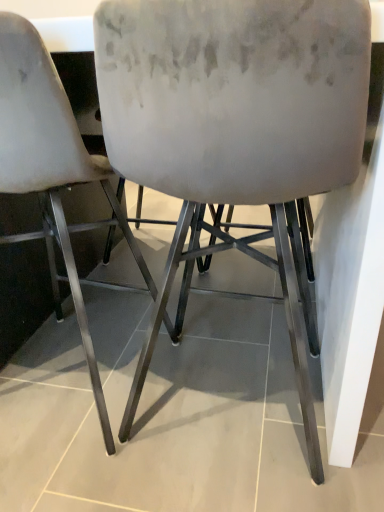
Question: Considering the relative sizes of satin white chair at center, placed as the 2th chair when sorted from right to left, and velvet beige chair at center, which appears as the first chair when viewed from the right, in the image provided, is satin white chair at center, placed as the 2th chair when sorted from right to left, smaller than velvet beige chair at center, which appears as the first chair when viewed from the right,?

Choices:
 (A) no
 (B) yes

Answer: (B)

Question: Can you confirm if satin white chair at center, placed as the 2th chair when sorted from right to left, is taller than velvet beige chair at center, the second chair viewed from the left?

Choices:
 (A) yes
 (B) no

Answer: (B)

Question: From a real-world perspective, is satin white chair at center, which appears as the 1th chair when viewed from the left, beneath velvet beige chair at center, which appears as the first chair when viewed from the right?

Choices:
 (A) yes
 (B) no

Answer: (B)

Question: Is satin white chair at center, placed as the 2th chair when sorted from right to left, outside velvet beige chair at center, which appears as the first chair when viewed from the right?

Choices:
 (A) no
 (B) yes

Answer: (B)

Question: Is satin white chair at center, placed as the 2th chair when sorted from right to left, further to camera compared to velvet beige chair at center, the second chair viewed from the left?

Choices:
 (A) yes
 (B) no

Answer: (A)

Question: From the image's perspective, is satin white chair at center, which appears as the 1th chair when viewed from the left, above velvet beige chair at center, which appears as the first chair when viewed from the right?

Choices:
 (A) no
 (B) yes

Answer: (B)

Question: Is velvet beige chair at center, which appears as the first chair when viewed from the right, positioned in front of satin white chair at center, placed as the 2th chair when sorted from right to left?

Choices:
 (A) yes
 (B) no

Answer: (A)

Question: Does velvet beige chair at center, which appears as the first chair when viewed from the right, have a greater height compared to satin white chair at center, which appears as the 1th chair when viewed from the left?

Choices:
 (A) yes
 (B) no

Answer: (A)

Question: Is velvet beige chair at center, the second chair viewed from the left, not within satin white chair at center, which appears as the 1th chair when viewed from the left?

Choices:
 (A) no
 (B) yes

Answer: (B)

Question: Can you confirm if velvet beige chair at center, which appears as the first chair when viewed from the right, is bigger than satin white chair at center, which appears as the 1th chair when viewed from the left?

Choices:
 (A) yes
 (B) no

Answer: (A)

Question: Is the depth of velvet beige chair at center, the second chair viewed from the left, greater than that of satin white chair at center, which appears as the 1th chair when viewed from the left?

Choices:
 (A) no
 (B) yes

Answer: (A)

Question: Is velvet beige chair at center, the second chair viewed from the left, beside satin white chair at center, placed as the 2th chair when sorted from right to left?

Choices:
 (A) no
 (B) yes

Answer: (A)

Question: Considering the positions of satin white chair at center, placed as the 2th chair when sorted from right to left, and velvet beige chair at center, the second chair viewed from the left, in the image, is satin white chair at center, placed as the 2th chair when sorted from right to left, taller or shorter than velvet beige chair at center, the second chair viewed from the left,?

Choices:
 (A) tall
 (B) short

Answer: (B)